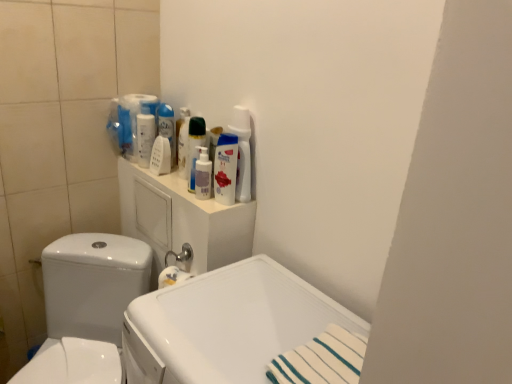
This screenshot has height=384, width=512. In order to click on vacant space that is to the left of white glossy bottle at upper center, which is counted as the 1th cleaning product, starting from the right in this screenshot , I will do `click(183, 194)`.